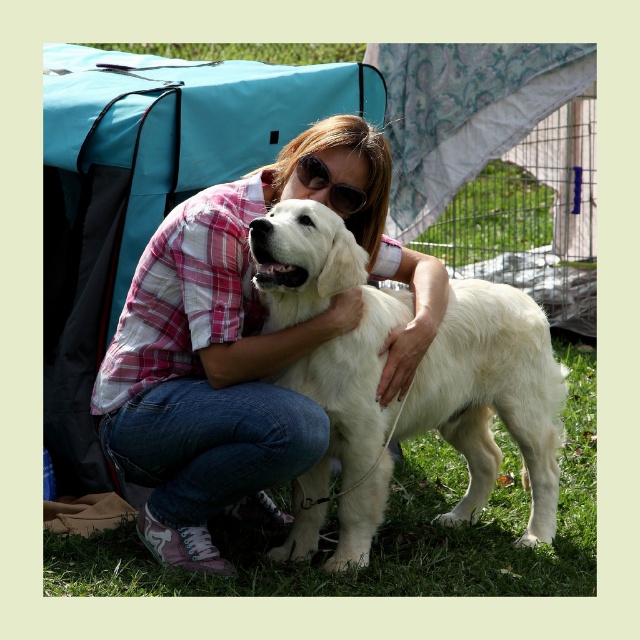
You are a photographer trying to capture the woman and her dog in the image. You want to adjust your camera to focus on the pink plaid shirt at center and sunglasses at center. Which object should you focus on first if you want to start with the one that is more to the left?

The pink plaid shirt at center is positioned on the left side of sunglasses at center, so you should focus on the pink plaid shirt at center first.

You are a photographer trying to capture the woman and her dog. You notice the white fluffy dog at center and the sunglasses at center. Which object is positioned closer to your camera lens?

The white fluffy dog at center is closer to the viewer than sunglasses at center, so the white fluffy dog at center would be positioned closer to the camera lens.